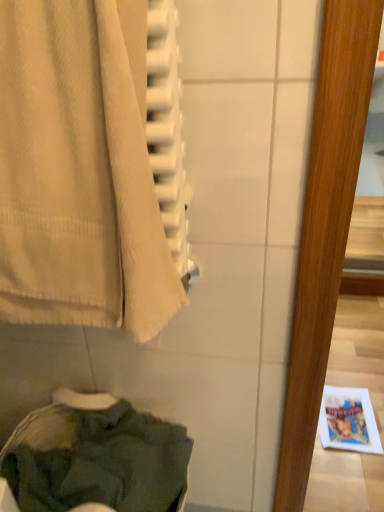
Locate an element on the screen. The width and height of the screenshot is (384, 512). dark green fabric at lower left is located at coordinates (96, 460).

The height and width of the screenshot is (512, 384). Describe the element at coordinates (96, 460) in the screenshot. I see `dark green fabric at lower left` at that location.

The height and width of the screenshot is (512, 384). What do you see at coordinates (79, 170) in the screenshot?
I see `beige cotton towel at left` at bounding box center [79, 170].

This screenshot has height=512, width=384. I want to click on beige cotton towel at left, so click(79, 170).

The width and height of the screenshot is (384, 512). Find the location of `dark green fabric at lower left`. dark green fabric at lower left is located at coordinates (96, 460).

Does beige cotton towel at left appear on the left side of dark green fabric at lower left?

No.

Which is in front, beige cotton towel at left or dark green fabric at lower left?

Positioned in front is beige cotton towel at left.

Considering the points (124, 124) and (7, 477), which point is in front, point (124, 124) or point (7, 477)?

Point (124, 124)

Based on the photo, from the image's perspective, which one is positioned lower, beige cotton towel at left or dark green fabric at lower left?

dark green fabric at lower left appears lower in the image.

From a real-world perspective, is beige cotton towel at left over dark green fabric at lower left?

Yes, from a real-world perspective, beige cotton towel at left is above dark green fabric at lower left.

Which object is thinner, beige cotton towel at left or dark green fabric at lower left?

Thinner between the two is beige cotton towel at left.

Is beige cotton towel at left taller than dark green fabric at lower left?

No, beige cotton towel at left is not taller than dark green fabric at lower left.

Is beige cotton towel at left smaller than dark green fabric at lower left?

Yes, beige cotton towel at left is smaller than dark green fabric at lower left.

Is beige cotton towel at left surrounding dark green fabric at lower left?

No, dark green fabric at lower left is not inside beige cotton towel at left.

Is beige cotton towel at left far away from dark green fabric at lower left?

No, beige cotton towel at left is in close proximity to dark green fabric at lower left.

Is beige cotton towel at left looking in the opposite direction of dark green fabric at lower left?

No, beige cotton towel at left is not facing away from dark green fabric at lower left.

How different are the orientations of beige cotton towel at left and dark green fabric at lower left in degrees?

88.4 degrees separate the facing orientations of beige cotton towel at left and dark green fabric at lower left.

Image resolution: width=384 pixels, height=512 pixels. Find the location of `clothing behind the beige cotton towel at left`. clothing behind the beige cotton towel at left is located at coordinates (96, 460).

Is dark green fabric at lower left at the right side of beige cotton towel at left?

No.

Considering the relative positions of dark green fabric at lower left and beige cotton towel at left in the image provided, is dark green fabric at lower left in front of beige cotton towel at left?

No, dark green fabric at lower left is behind beige cotton towel at left.

Which is farther, (x=123, y=447) or (x=32, y=263)?

Point (x=123, y=447)

From the image's perspective, between dark green fabric at lower left and beige cotton towel at left, who is located below?

dark green fabric at lower left, from the image's perspective.

From a real-world perspective, is dark green fabric at lower left located beneath beige cotton towel at left?

Yes, from a real-world perspective, dark green fabric at lower left is below beige cotton towel at left.

Is dark green fabric at lower left thinner than beige cotton towel at left?

No, dark green fabric at lower left is not thinner than beige cotton towel at left.

Does dark green fabric at lower left have a lesser height compared to beige cotton towel at left?

In fact, dark green fabric at lower left may be taller than beige cotton towel at left.

Based on their sizes in the image, would you say dark green fabric at lower left is bigger or smaller than beige cotton towel at left?

dark green fabric at lower left is bigger than beige cotton towel at left.

Can we say dark green fabric at lower left lies outside beige cotton towel at left?

dark green fabric at lower left is positioned outside beige cotton towel at left.

Is dark green fabric at lower left not near beige cotton towel at left?

No, dark green fabric at lower left is not far away from beige cotton towel at left.

Is dark green fabric at lower left facing away from beige cotton towel at left?

No.

What's the angular difference between dark green fabric at lower left and beige cotton towel at left's facing directions?

They differ by 88.4 degrees in their facing directions.

You are a GUI agent. You are given a task and a screenshot of the screen. Output one action in this format:
    pyautogui.click(x=<x>, y=<y>)
    Task: Click on the clothing directly beneath the beige cotton towel at left (from a real-world perspective)
    Image resolution: width=384 pixels, height=512 pixels.
    Given the screenshot: What is the action you would take?
    pyautogui.click(x=96, y=460)

Image resolution: width=384 pixels, height=512 pixels. I want to click on clothing behind the beige cotton towel at left, so pos(96,460).

At what (x,y) coordinates should I click in order to perform the action: click on towel located in front of the dark green fabric at lower left. Please return your answer as a coordinate pair (x, y). This screenshot has height=512, width=384. Looking at the image, I should click on (79, 170).